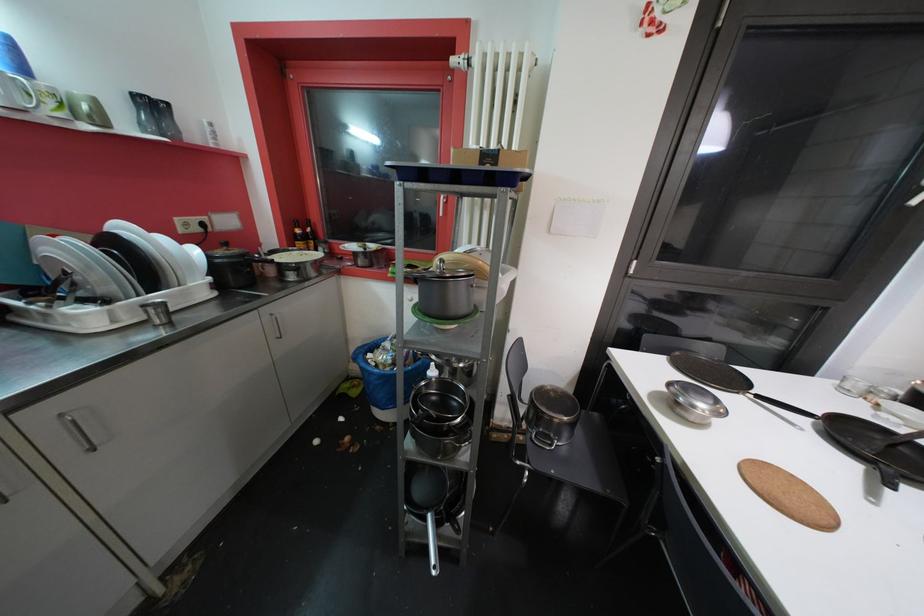
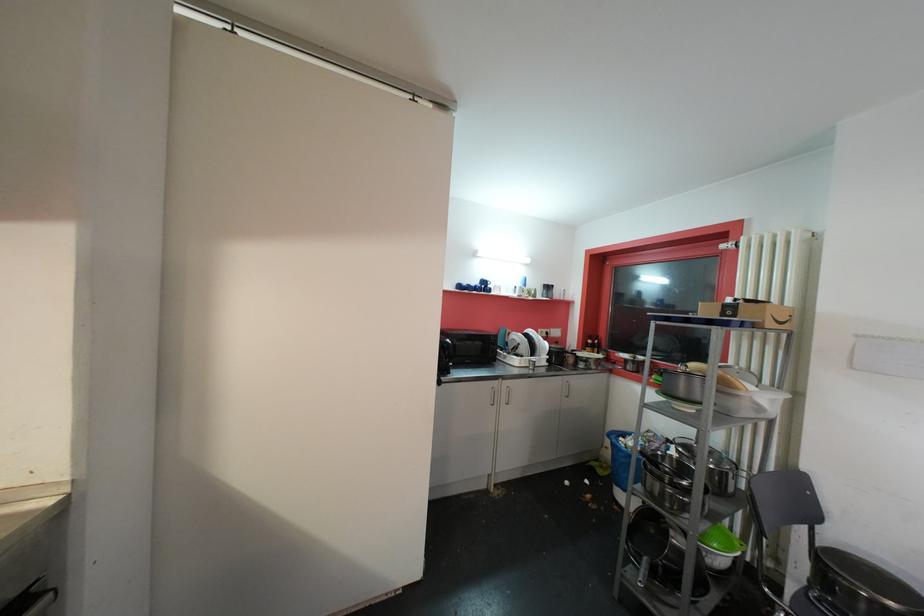
The point at (102, 105) is marked in the first image. Where is the corresponding point in the second image?

(541, 293)